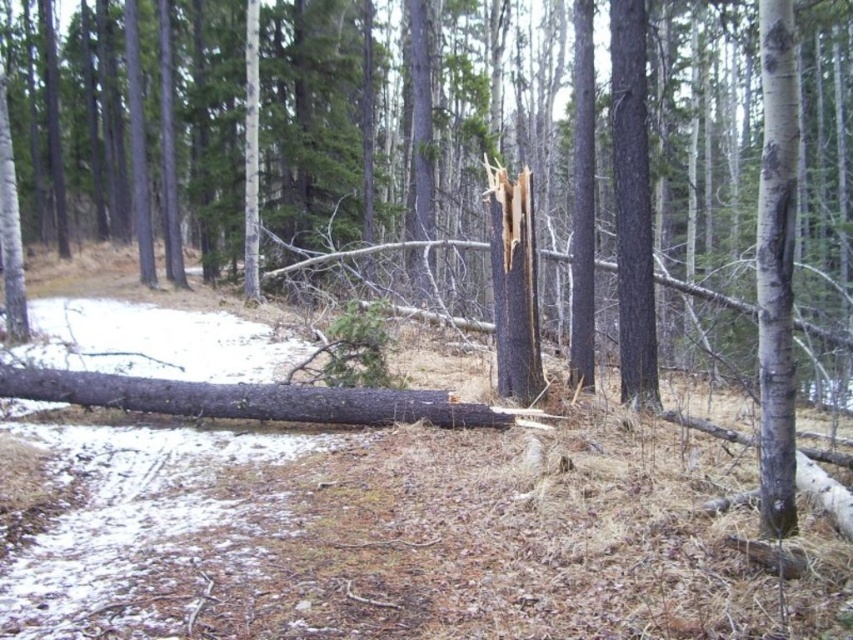
Who is shorter, white bark tree trunk at right or dark gray bark log at center?

Standing shorter between the two is dark gray bark log at center.

Is point (776, 148) positioned after point (91, 396)?

No, it is not.

Find the location of `white bark tree trunk at right`. white bark tree trunk at right is located at coordinates (776, 268).